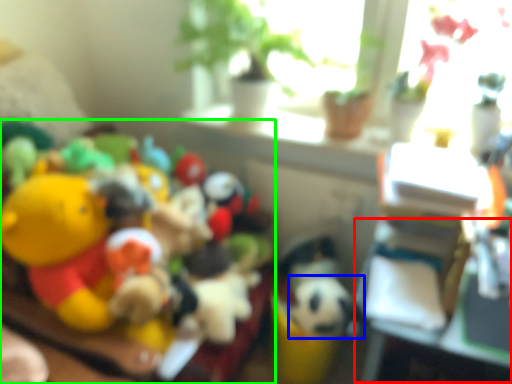
Question: Based on their relative distances, which object is nearer to table (highlighted by a red box)? Choose from animal (highlighted by a blue box) and toy (highlighted by a green box).

Choices:
 (A) animal
 (B) toy

Answer: (A)